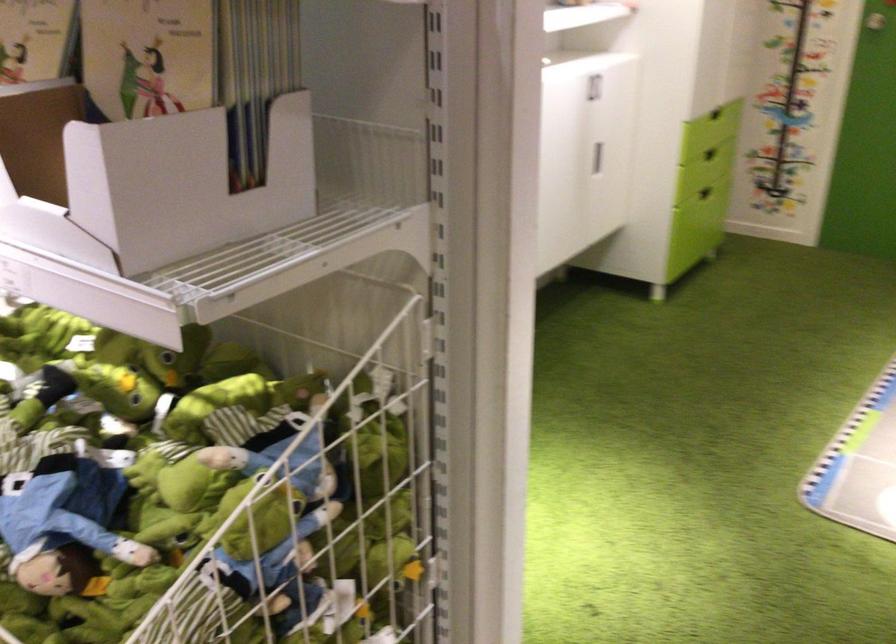
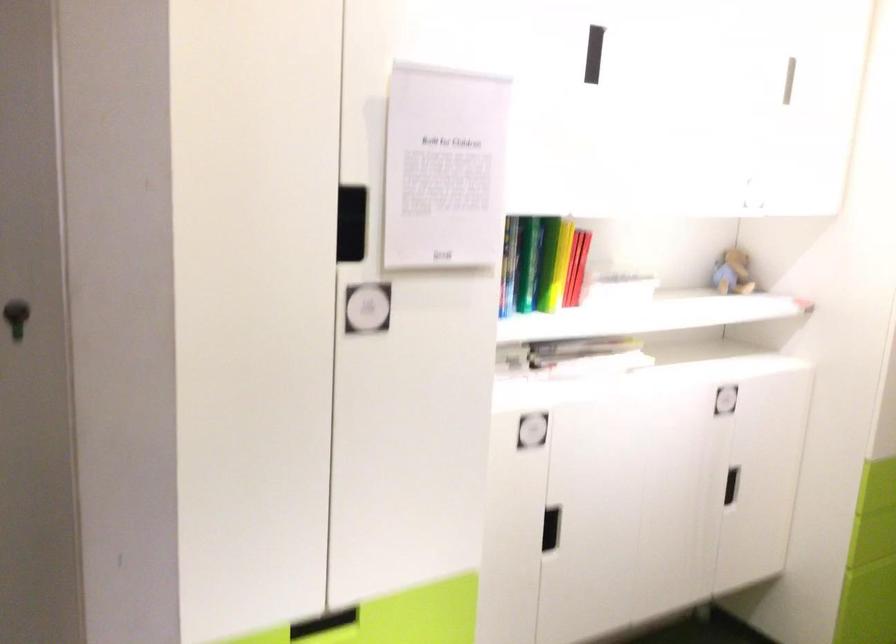
In a continuous first-person perspective shot, in which direction is the camera moving?

The cameraman walked toward right, forward.